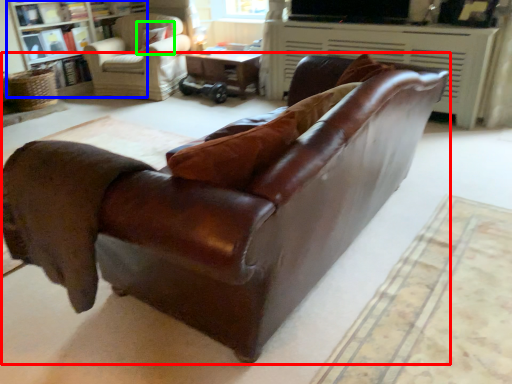
Question: Considering the real-world distances, which object is farthest from studio couch (highlighted by a red box)? bookcase (highlighted by a blue box) or pillow (highlighted by a green box)?

Choices:
 (A) bookcase
 (B) pillow

Answer: (A)